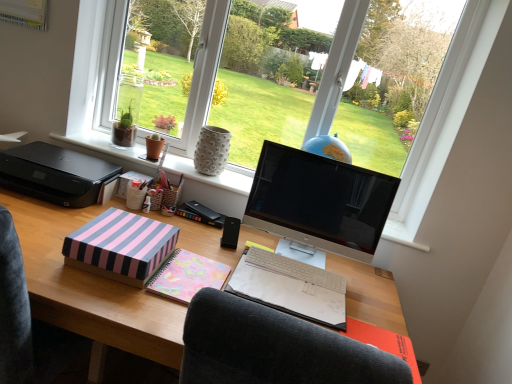
Find the location of `vacant space in pastel floral notebook at center (from a real-world perspective)`. vacant space in pastel floral notebook at center (from a real-world perspective) is located at coordinates (284, 290).